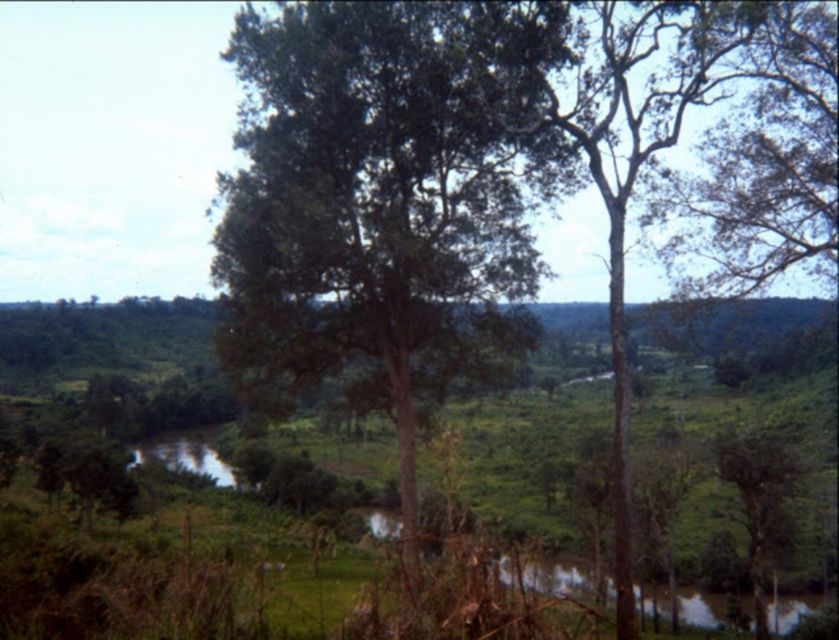
You are planning to plant a new tree in this landscape. The green leafy tree at center and the green rough bark tree at center are already present. Which tree has a narrower trunk? Please refer to their widths as described.

The green leafy tree at center has a narrower trunk since its width is less than that of the green rough bark tree at center.

You are a hiker standing in the middle of the landscape and want to take a photo of both the green leafy tree at center and the green rough bark tree at center. Which tree should you move towards if you want to include both in your frame without zooming in?

The green leafy tree at center is positioned on the left side of green rough bark tree at center, so you should move towards the tree that is further away from both to include both in your frame without zooming in.

Based on the photo, you are standing in the lush landscape and want to take a photo of both the green leafy tree at center and the green rough bark tree at center. Which tree should you focus on first to ensure both are in clear view?

You should focus on the green leafy tree at center first because it is in front of the green rough bark tree at center, so adjusting focus to the closer tree will help both be in clear view.